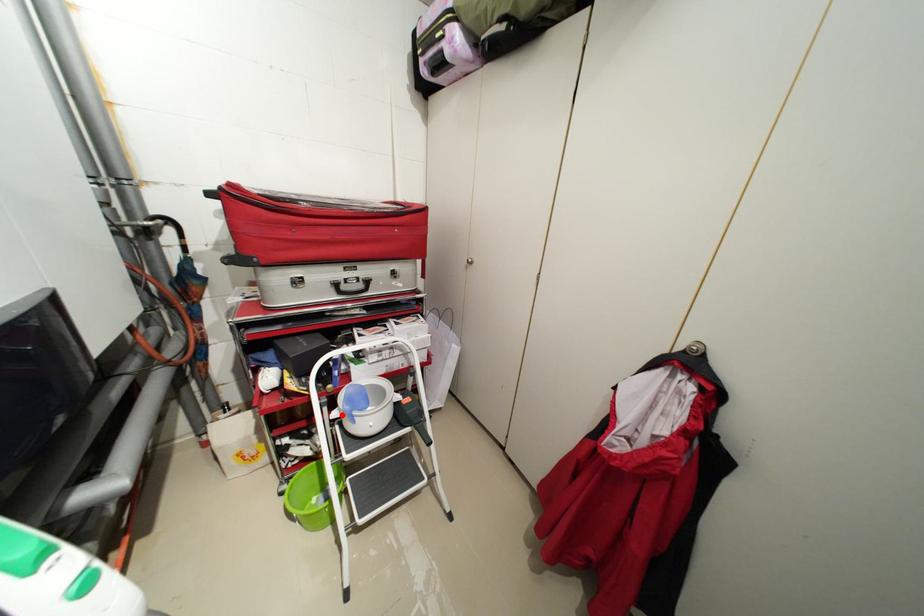
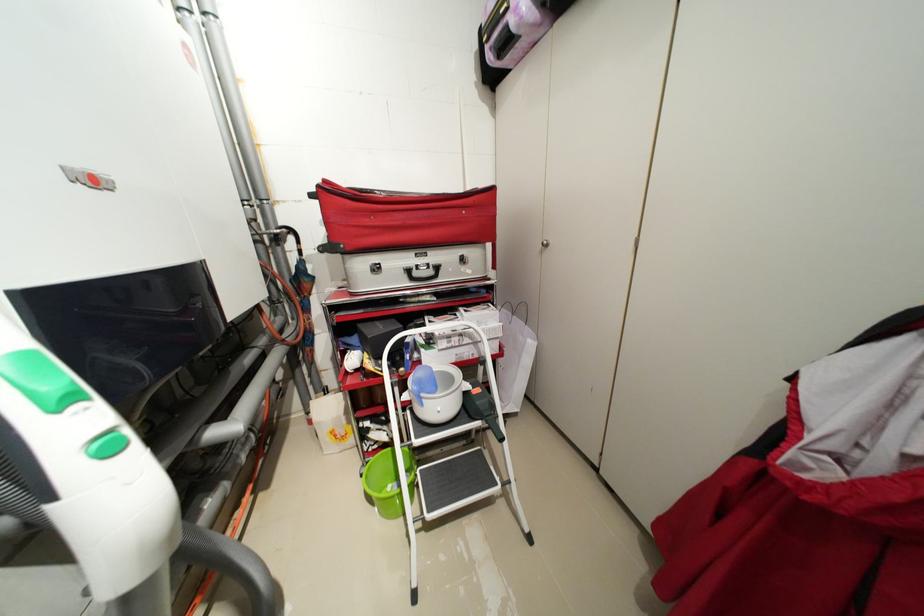
Find the pixel in the second image that matches the highlighted location in the first image.

(412, 398)